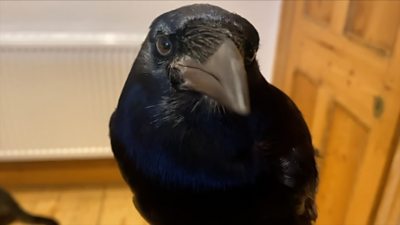
Find the location of a particular element. white wall is located at coordinates (90, 18).